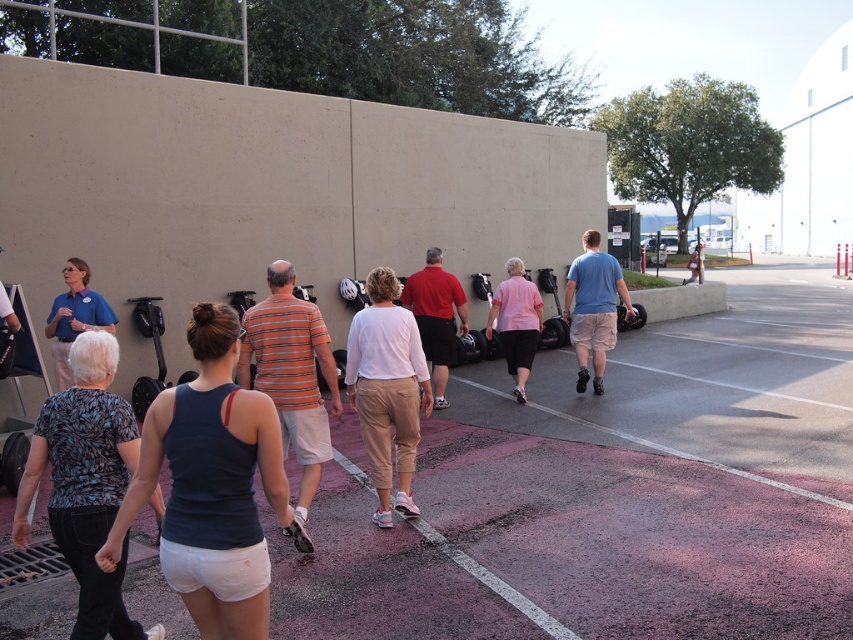
You are standing at the camera position and want to find the red matte shirt at center. According to the image coordinates, where should you look to locate it?

The red matte shirt at center is located at the 2D coordinates point (436,317), so you should look towards the center of the image to find it.

You are a pedestrian trying to cross the parking lot. You see the pink asphalt at lower center and the matte black helmet at upper center. Which object is closer to the ground?

The pink asphalt at lower center is positioned under matte black helmet at upper center, so the pink asphalt at lower center is closer to the ground.